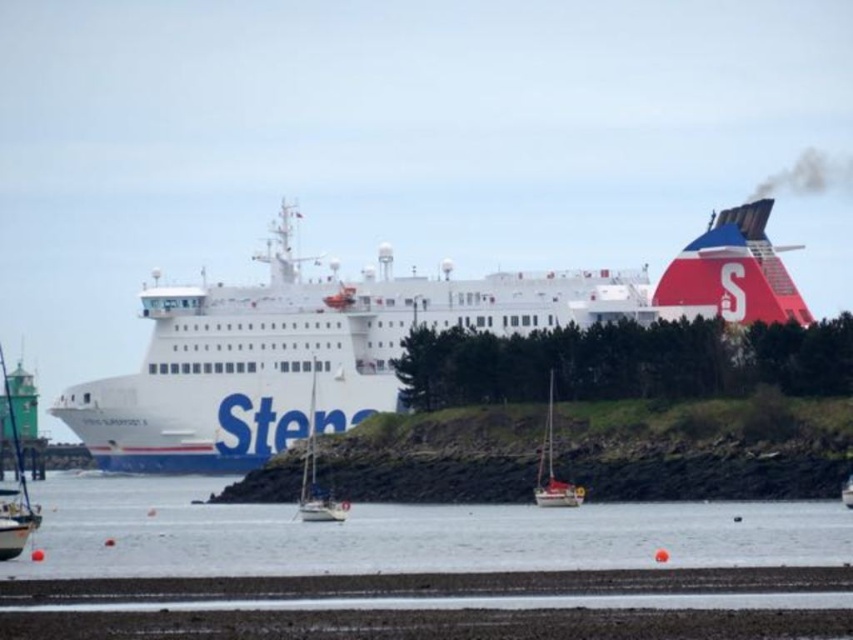
You are standing at the shore looking towards the ferry ship. There are two points marked on the water surface. The first point is at coordinate point (x=729, y=304) and the second is at point (x=1, y=520). If you want to reach the ferry ship first, which point should you start from?

You should start from point (x=1, y=520) because it is closer to the ferry ship than point (x=729, y=304), which is behind it.

Looking at this image, you are standing on the ferry ship and want to walk from the current location to the exit door. You notice two points marked on the ship deck. The first point is at coordinate point (490, 317) and the second is at point (64, 486). Which point is closer to the exit door located at the ship bow?

Point (64, 486) is closer to the exit door located at the ship bow because it is positioned lower on the coordinate system, which typically corresponds to the front of the ship.

You are a dock worker who needs to ensure that both the white matte cargo ship at center and the green painted wood boat at left can fit through a narrow channel. Based on their widths, which ship should you prioritize moving first?

The green painted wood boat at left should be prioritized since it is narrower. However, the white matte cargo ship at center might be wider than the green painted wood boat at left, so you should verify their exact widths before deciding.